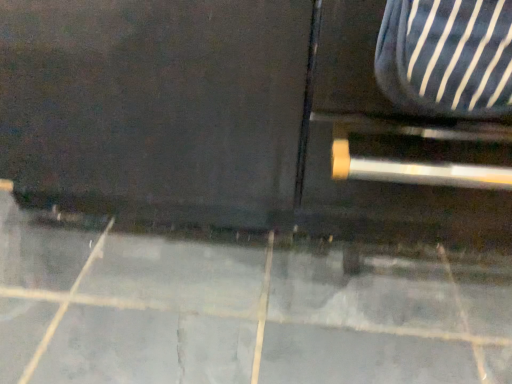
Question: Is gray tile floor at lower center not close to striped fabric armchair at right?

Choices:
 (A) yes
 (B) no

Answer: (B)

Question: Is gray tile floor at lower center smaller than striped fabric armchair at right?

Choices:
 (A) yes
 (B) no

Answer: (B)

Question: Is gray tile floor at lower center to the left of striped fabric armchair at right from the viewer's perspective?

Choices:
 (A) no
 (B) yes

Answer: (B)

Question: Can you confirm if gray tile floor at lower center is positioned to the right of striped fabric armchair at right?

Choices:
 (A) no
 (B) yes

Answer: (A)

Question: Considering the relative sizes of gray tile floor at lower center and striped fabric armchair at right in the image provided, is gray tile floor at lower center thinner than striped fabric armchair at right?

Choices:
 (A) yes
 (B) no

Answer: (B)

Question: From a real-world perspective, does gray tile floor at lower center stand above striped fabric armchair at right?

Choices:
 (A) yes
 (B) no

Answer: (B)

Question: From a real-world perspective, is striped fabric armchair at right below gray tile floor at lower center?

Choices:
 (A) yes
 (B) no

Answer: (B)

Question: Is striped fabric armchair at right facing away from gray tile floor at lower center?

Choices:
 (A) yes
 (B) no

Answer: (B)

Question: Is striped fabric armchair at right not inside gray tile floor at lower center?

Choices:
 (A) yes
 (B) no

Answer: (A)

Question: Would you say striped fabric armchair at right is a long distance from gray tile floor at lower center?

Choices:
 (A) yes
 (B) no

Answer: (B)

Question: Does striped fabric armchair at right appear on the left side of gray tile floor at lower center?

Choices:
 (A) no
 (B) yes

Answer: (A)

Question: Is striped fabric armchair at right bigger than gray tile floor at lower center?

Choices:
 (A) yes
 (B) no

Answer: (B)

Question: Is gray tile floor at lower center wider or thinner than striped fabric armchair at right?

Choices:
 (A) wide
 (B) thin

Answer: (A)